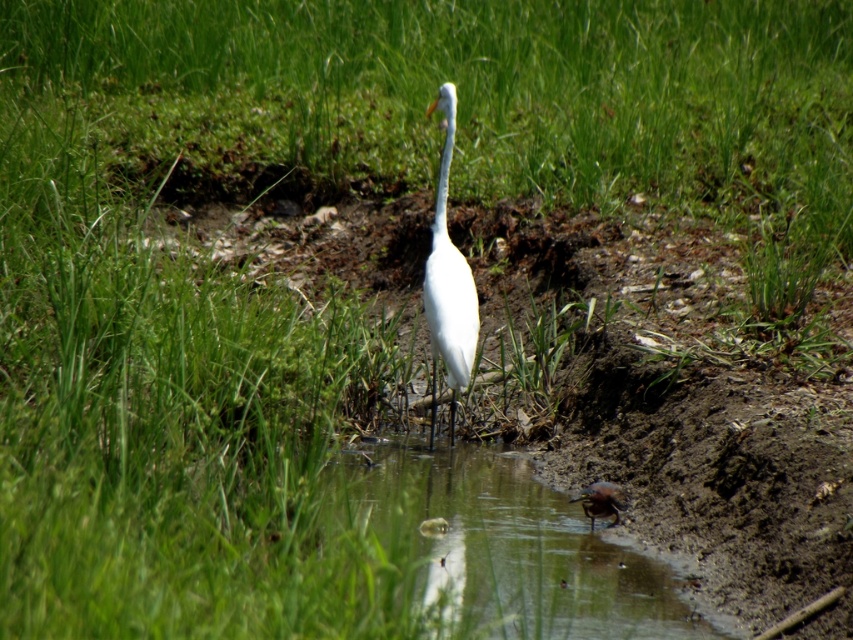
Question: Which point appears closest to the camera in this image?

Choices:
 (A) 437,186
 (B) 345,492

Answer: (B)

Question: Can you confirm if clear water at lower center is wider than white smooth heron at center?

Choices:
 (A) no
 (B) yes

Answer: (B)

Question: Which of the following is the farthest from the observer?

Choices:
 (A) (569, 522)
 (B) (468, 371)

Answer: (B)

Question: Does clear water at lower center have a lesser width compared to white smooth heron at center?

Choices:
 (A) yes
 (B) no

Answer: (B)

Question: Can you confirm if clear water at lower center is positioned below white smooth heron at center?

Choices:
 (A) yes
 (B) no

Answer: (A)